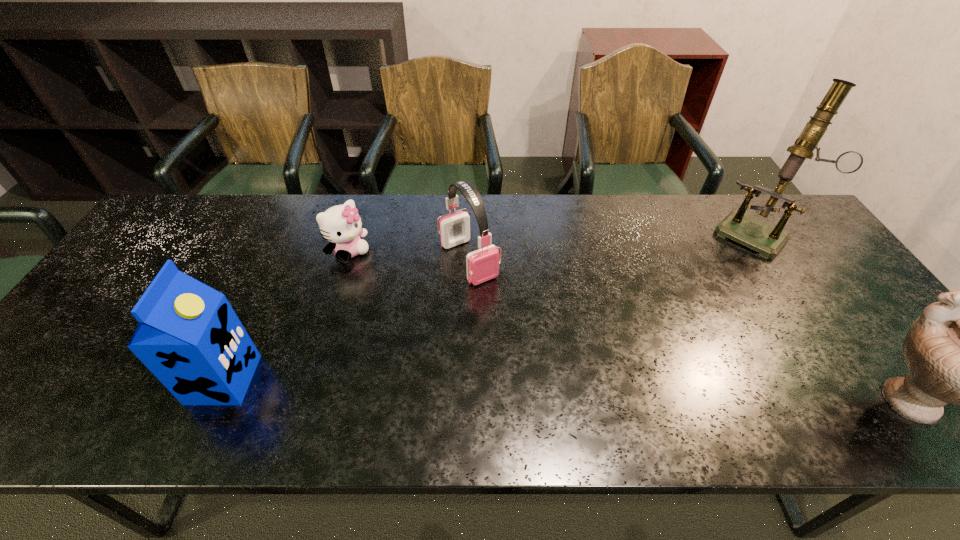
Where is `vacant space on the desktop that is between the carton and the urn and is positioned on the outer surface of the third object from left to right`? This screenshot has height=540, width=960. vacant space on the desktop that is between the carton and the urn and is positioned on the outer surface of the third object from left to right is located at coordinates (571, 393).

You are a GUI agent. You are given a task and a screenshot of the screen. Output one action in this format:
    pyautogui.click(x=<x>, y=<y>)
    Task: Click on the vacant spot on the desktop that is between the carton and the urn and is positioned at the eyepiece of the microscope
    The image size is (960, 540).
    Given the screenshot: What is the action you would take?
    pyautogui.click(x=612, y=395)

Where is `free space on the desktop that is between the leftmost object and the urn and is positioned on the front-facing side of the second object from left to right`? The height and width of the screenshot is (540, 960). free space on the desktop that is between the leftmost object and the urn and is positioned on the front-facing side of the second object from left to right is located at coordinates (489, 390).